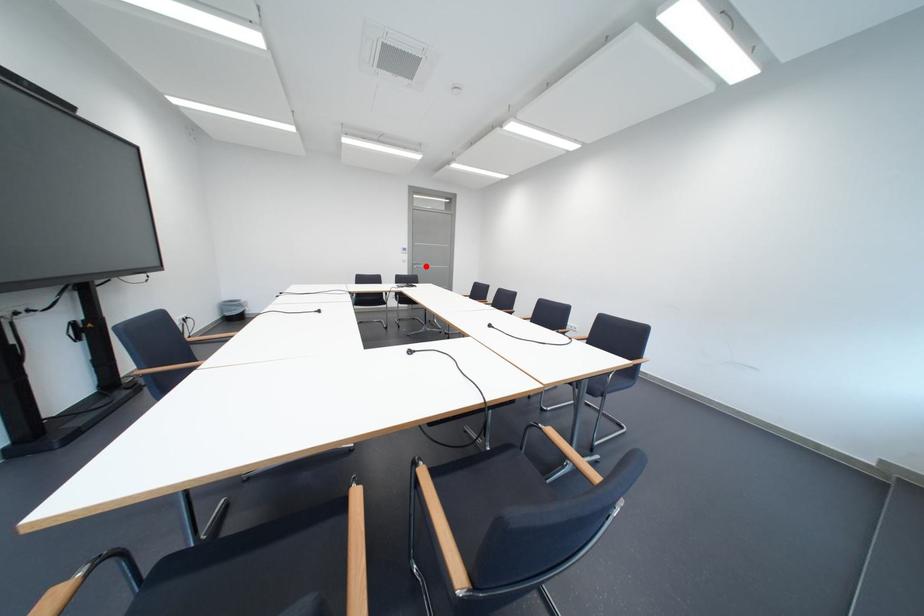
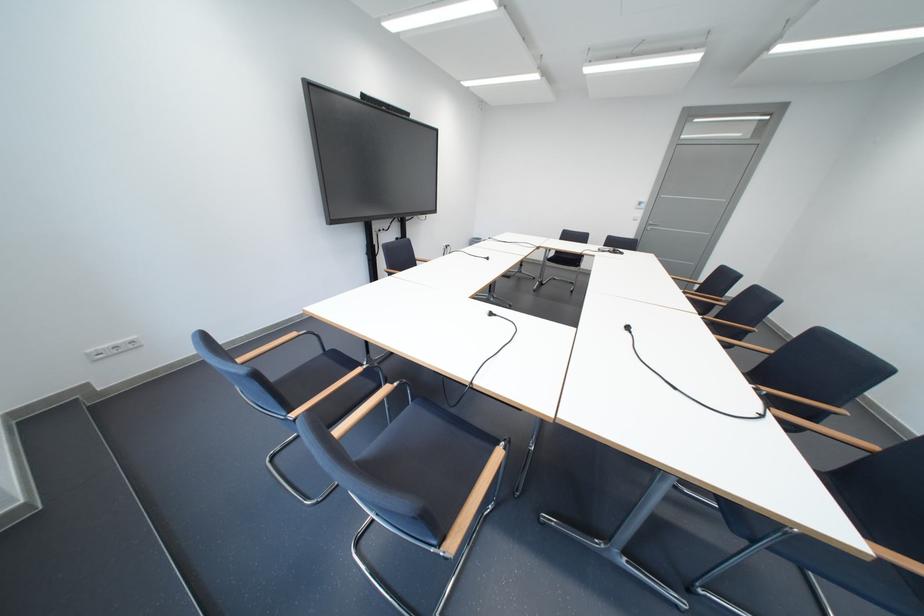
Question: I am providing you with two images of the same scene from different viewpoints. In image1, a red point is highlighted. Considering the same 3D point in image2, which of the following is correct?

Choices:
 (A) It is closer
 (B) It is farther

Answer: (B)